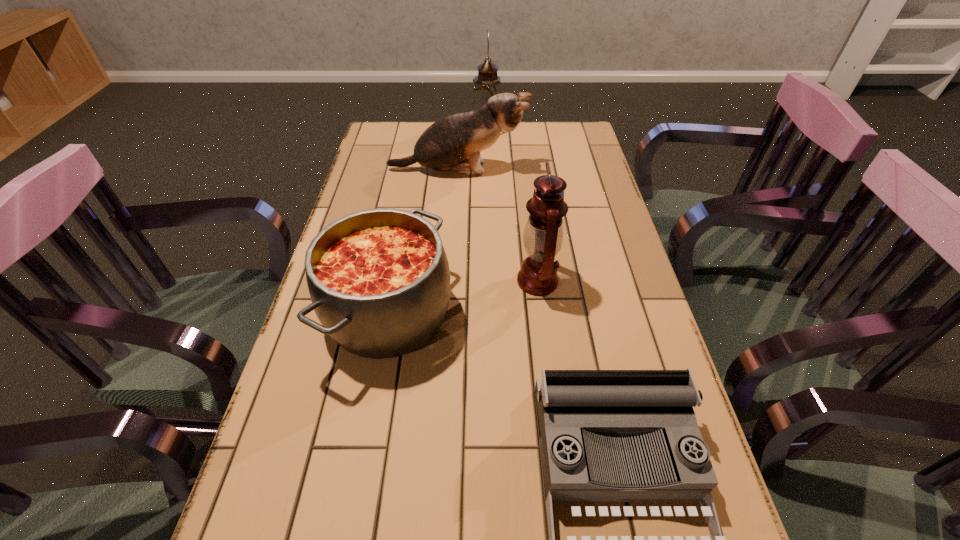
Select which object appears as the second closest to the fourth tallest object. Please provide its 2D coordinates. Your answer should be formatted as a tuple, i.e. [(x, y)], where the tuple contains the x and y coordinates of a point satisfying the conditions above.

[(579, 412)]

Identify the location of free space that satisfies the following two spatial constraints: 1. at the face of the cat; 2. on the back side of the right oil lamp. The height and width of the screenshot is (540, 960). (450, 281).